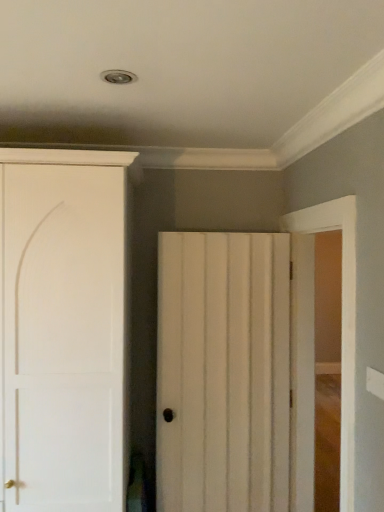
Question: From a real-world perspective, is white wood door at center, arranged as the 2th door when viewed from the left, above or below white matte door at left, the second door positioned from the right?

Choices:
 (A) above
 (B) below

Answer: (B)

Question: Would you say white wood door at center, arranged as the 2th door when viewed from the left, is inside or outside white matte door at left, which ranks as the first door in left-to-right order?

Choices:
 (A) outside
 (B) inside

Answer: (A)

Question: From the image's perspective, relative to white matte door at left, the second door positioned from the right, is white wood door at center, arranged as the 1th door when viewed from the right, above or below?

Choices:
 (A) below
 (B) above

Answer: (A)

Question: Based on their sizes in the image, would you say white matte door at left, the second door positioned from the right, is bigger or smaller than white wood door at center, arranged as the 1th door when viewed from the right?

Choices:
 (A) small
 (B) big

Answer: (B)

Question: Considering the positions of point (74, 444) and point (236, 504), is point (74, 444) closer or farther from the camera than point (236, 504)?

Choices:
 (A) farther
 (B) closer

Answer: (B)

Question: From the image's perspective, is white matte door at left, the second door positioned from the right, located above or below white wood door at center, arranged as the 1th door when viewed from the right?

Choices:
 (A) above
 (B) below

Answer: (A)

Question: Visually, is white matte door at left, the second door positioned from the right, positioned to the left or to the right of white wood door at center, arranged as the 2th door when viewed from the left?

Choices:
 (A) left
 (B) right

Answer: (A)